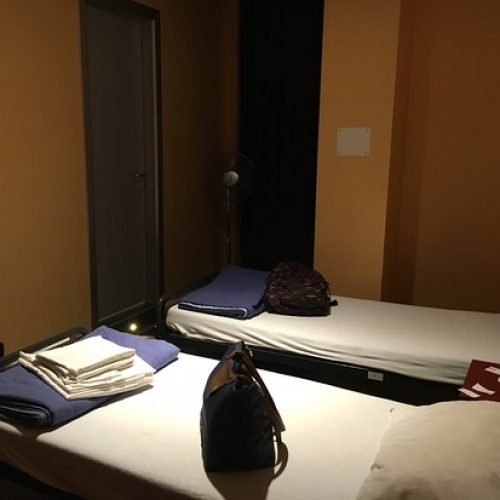
Locate an element on the screen. The height and width of the screenshot is (500, 500). metal bed frame is located at coordinates (169, 295), (70, 332).